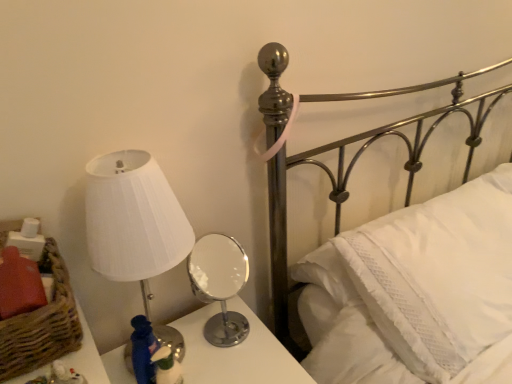
Question: Is the position of metallic silver bed at upper right less distant than that of polished chrome mirror at center?

Choices:
 (A) no
 (B) yes

Answer: (B)

Question: From a real-world perspective, is metallic silver bed at upper right located higher than polished chrome mirror at center?

Choices:
 (A) no
 (B) yes

Answer: (B)

Question: Is metallic silver bed at upper right not inside polished chrome mirror at center?

Choices:
 (A) no
 (B) yes

Answer: (B)

Question: Is metallic silver bed at upper right at the left side of polished chrome mirror at center?

Choices:
 (A) yes
 (B) no

Answer: (B)

Question: From the image's perspective, does metallic silver bed at upper right appear higher than polished chrome mirror at center?

Choices:
 (A) yes
 (B) no

Answer: (A)

Question: Is metallic silver bed at upper right aimed at polished chrome mirror at center?

Choices:
 (A) yes
 (B) no

Answer: (B)

Question: Is polished chrome mirror at center to the right of metallic silver bed at upper right from the viewer's perspective?

Choices:
 (A) yes
 (B) no

Answer: (B)

Question: Are polished chrome mirror at center and metallic silver bed at upper right making contact?

Choices:
 (A) no
 (B) yes

Answer: (A)

Question: Does polished chrome mirror at center have a greater width compared to metallic silver bed at upper right?

Choices:
 (A) no
 (B) yes

Answer: (A)

Question: Does polished chrome mirror at center come behind metallic silver bed at upper right?

Choices:
 (A) yes
 (B) no

Answer: (A)

Question: Considering the relative sizes of polished chrome mirror at center and metallic silver bed at upper right in the image provided, is polished chrome mirror at center taller than metallic silver bed at upper right?

Choices:
 (A) no
 (B) yes

Answer: (A)

Question: From a real-world perspective, is polished chrome mirror at center positioned under metallic silver bed at upper right based on gravity?

Choices:
 (A) yes
 (B) no

Answer: (A)

Question: Does white pleated fabric lampshade at left have a larger size compared to metallic silver bed at upper right?

Choices:
 (A) yes
 (B) no

Answer: (B)